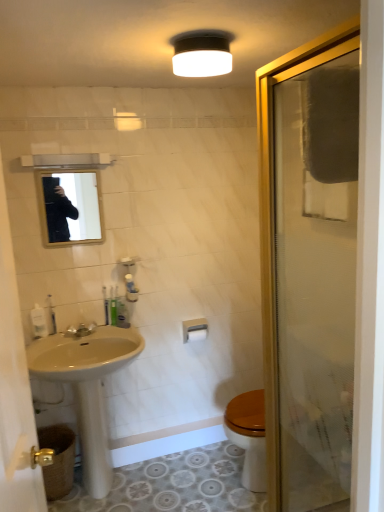
Where is `vacant space that is in between matte silver faucet at lower left and green plastic toothbrush at lower left, acting as the first toiletry starting from the right`? The image size is (384, 512). vacant space that is in between matte silver faucet at lower left and green plastic toothbrush at lower left, acting as the first toiletry starting from the right is located at coordinates (97, 331).